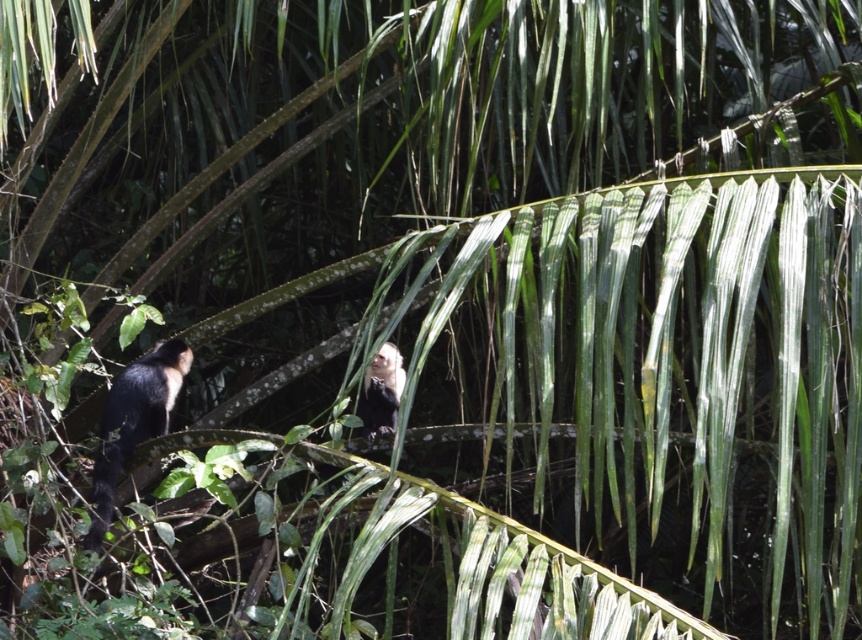
Question: Which point is closer to the camera taking this photo?

Choices:
 (A) (392, 406)
 (B) (173, 374)

Answer: (B)

Question: Is black fur monkey at left bigger than white fur monkey at upper center?

Choices:
 (A) no
 (B) yes

Answer: (B)

Question: Which point is farther to the camera?

Choices:
 (A) click(392, 404)
 (B) click(132, 372)

Answer: (B)

Question: Is black fur monkey at left below white fur monkey at upper center?

Choices:
 (A) yes
 (B) no

Answer: (A)

Question: Is black fur monkey at left bigger than white fur monkey at upper center?

Choices:
 (A) no
 (B) yes

Answer: (B)